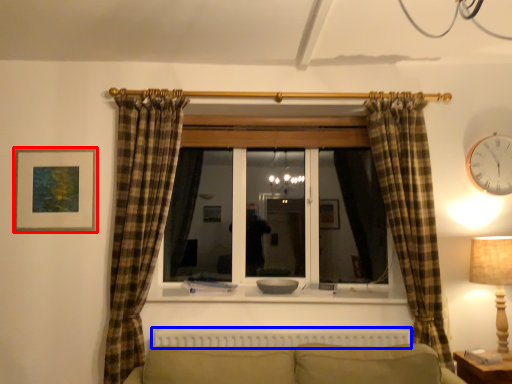
Question: Which object is closer to the camera taking this photo, picture frame (highlighted by a red box) or radiator (highlighted by a blue box)?

Choices:
 (A) picture frame
 (B) radiator

Answer: (B)